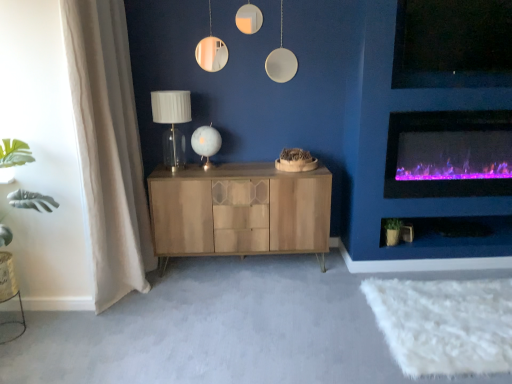
Question: Does white glass table lamp at center, positioned as the 1th table lamp in right-to-left order, have a lesser width compared to matte white glass table lamp at center, placed as the 2th table lamp when sorted from right to left?

Choices:
 (A) yes
 (B) no

Answer: (A)

Question: Is white glass table lamp at center, which is the 2th table lamp in left-to-right order, completely or partially outside of matte white glass table lamp at center, marked as the 1th table lamp in a left-to-right arrangement?

Choices:
 (A) no
 (B) yes

Answer: (B)

Question: From the image's perspective, is white glass table lamp at center, positioned as the 1th table lamp in right-to-left order, above matte white glass table lamp at center, marked as the 1th table lamp in a left-to-right arrangement?

Choices:
 (A) yes
 (B) no

Answer: (B)

Question: Considering the relative sizes of white glass table lamp at center, positioned as the 1th table lamp in right-to-left order, and matte white glass table lamp at center, marked as the 1th table lamp in a left-to-right arrangement, in the image provided, is white glass table lamp at center, positioned as the 1th table lamp in right-to-left order, wider than matte white glass table lamp at center, marked as the 1th table lamp in a left-to-right arrangement,?

Choices:
 (A) yes
 (B) no

Answer: (B)

Question: From the image's perspective, is white glass table lamp at center, which is the 2th table lamp in left-to-right order, below matte white glass table lamp at center, marked as the 1th table lamp in a left-to-right arrangement?

Choices:
 (A) no
 (B) yes

Answer: (B)

Question: From a real-world perspective, is white glass table lamp at center, positioned as the 1th table lamp in right-to-left order, over matte white glass table lamp at center, marked as the 1th table lamp in a left-to-right arrangement?

Choices:
 (A) no
 (B) yes

Answer: (A)

Question: Is wooden cabinet at center behind beige fabric curtain at left?

Choices:
 (A) no
 (B) yes

Answer: (B)

Question: Is wooden cabinet at center oriented towards beige fabric curtain at left?

Choices:
 (A) no
 (B) yes

Answer: (A)

Question: Is wooden cabinet at center bigger than beige fabric curtain at left?

Choices:
 (A) yes
 (B) no

Answer: (B)

Question: Can you confirm if wooden cabinet at center is wider than beige fabric curtain at left?

Choices:
 (A) yes
 (B) no

Answer: (A)

Question: From the image's perspective, is wooden cabinet at center on beige fabric curtain at left?

Choices:
 (A) no
 (B) yes

Answer: (A)

Question: From the image's perspective, is wooden cabinet at center beneath beige fabric curtain at left?

Choices:
 (A) yes
 (B) no

Answer: (A)

Question: From the image's perspective, does green matte plant at lower right appear higher than purple electric fireplace at right?

Choices:
 (A) no
 (B) yes

Answer: (A)